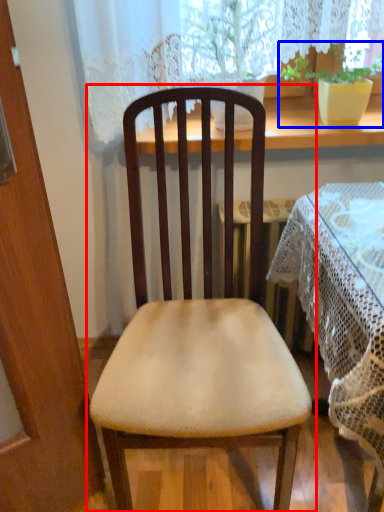
Question: Which object is further to the camera taking this photo, chair (highlighted by a red box) or houseplant (highlighted by a blue box)?

Choices:
 (A) chair
 (B) houseplant

Answer: (B)